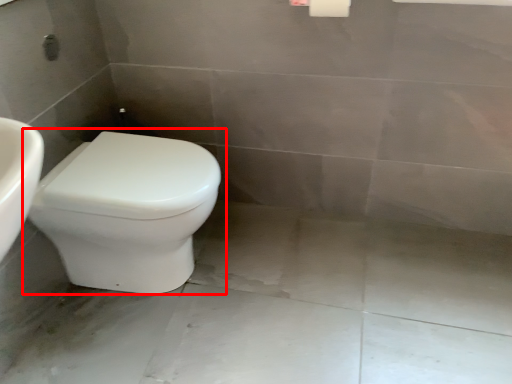
Question: From the image, what is the correct spatial relationship of toilet (annotated by the red box) in relation to concrete?

Choices:
 (A) right
 (B) left

Answer: (B)